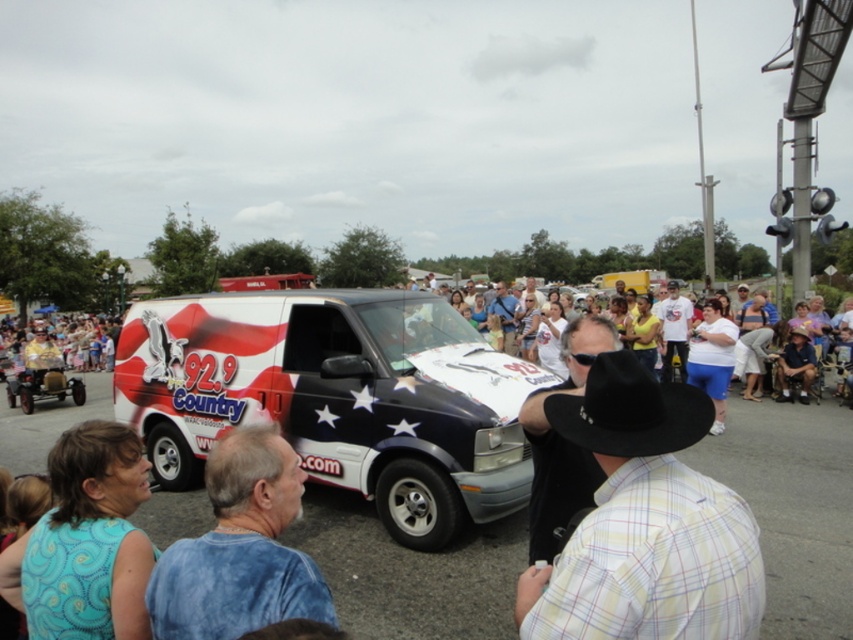
Question: Which object appears closest to the camera in this image?

Choices:
 (A) painted vinyl van at center
 (B) white cotton shirt at left

Answer: (A)

Question: Which point appears farthest from the camera in this image?

Choices:
 (A) (575, 424)
 (B) (267, 554)

Answer: (B)

Question: Estimate the real-world distances between objects in this image. Which object is farther from the blue tie-dye shirt at lower left?

Choices:
 (A) white cotton shirt at center
 (B) white cotton shirt at left
 (C) plaid cotton shirt at center
 (D) painted vinyl van at center

Answer: (A)

Question: Where is plaid cotton shirt at center located in relation to blue tie-dye shirt at lower left in the image?

Choices:
 (A) above
 (B) below

Answer: (A)

Question: Does blue tie-dye shirt at lower left have a smaller size compared to white cotton shirt at left?

Choices:
 (A) yes
 (B) no

Answer: (A)

Question: Does blue tie-dye shirt at lower left appear on the right side of black felt cowboy hat at center?

Choices:
 (A) yes
 (B) no

Answer: (B)